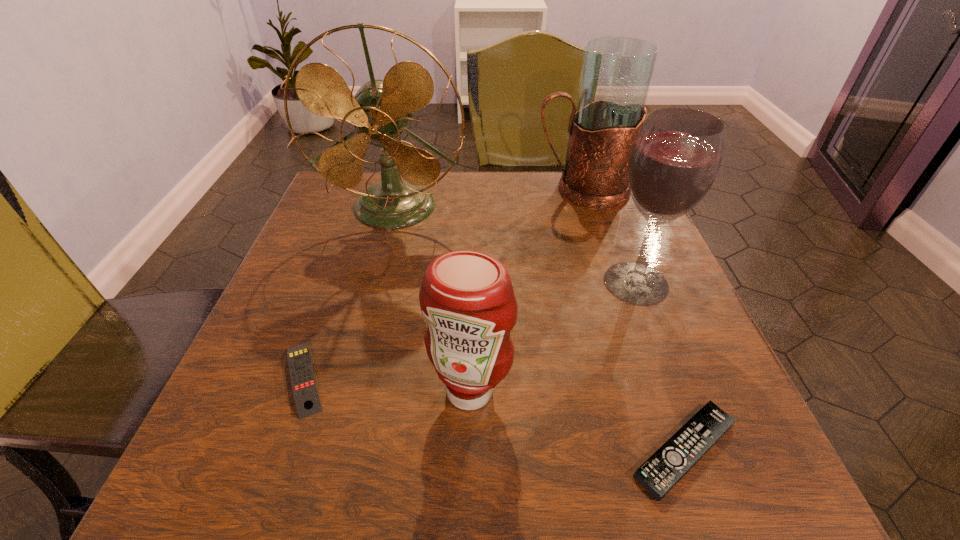
Identify the location of remote control present at the left edge. The image size is (960, 540). (305, 392).

Identify the location of pitcher at the right edge. The height and width of the screenshot is (540, 960). (616, 74).

Find the location of a particular element. The width and height of the screenshot is (960, 540). alcohol that is at the right edge is located at coordinates (675, 159).

Find the location of a particular element. remote control present at the right edge is located at coordinates (661, 472).

The width and height of the screenshot is (960, 540). I want to click on object at the far left corner, so click(380, 110).

Locate an element on the screen. object at the far right corner is located at coordinates (616, 74).

Find the location of a particular element. This screenshot has width=960, height=540. object that is at the near right corner is located at coordinates [661, 472].

Find the location of a particular element. vacant space at the far edge of the desktop is located at coordinates (451, 205).

You are a GUI agent. You are given a task and a screenshot of the screen. Output one action in this format:
    pyautogui.click(x=<x>, y=<y>)
    Task: Click on the vacant area at the near edge
    
    Given the screenshot: What is the action you would take?
    pyautogui.click(x=405, y=464)

You are a GUI agent. You are given a task and a screenshot of the screen. Output one action in this format:
    pyautogui.click(x=<x>, y=<y>)
    Task: Click on the free space at the left edge
    This screenshot has width=960, height=540.
    Given the screenshot: What is the action you would take?
    pyautogui.click(x=288, y=344)